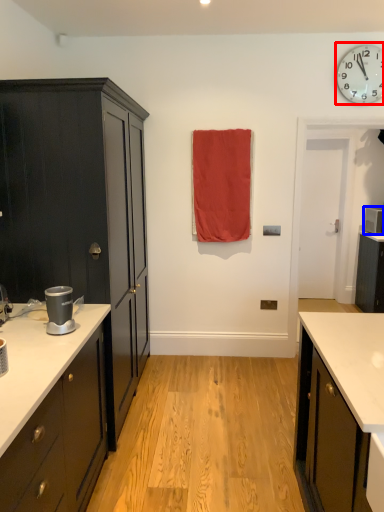
Question: Which of the following is the closest to the observer, wall clock (highlighted by a red box) or appliance (highlighted by a blue box)?

Choices:
 (A) wall clock
 (B) appliance

Answer: (A)